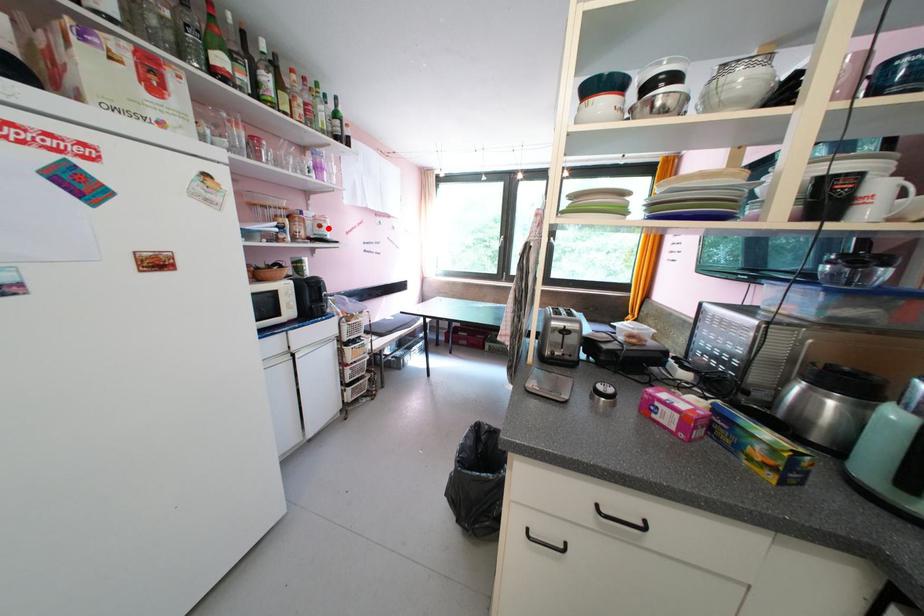
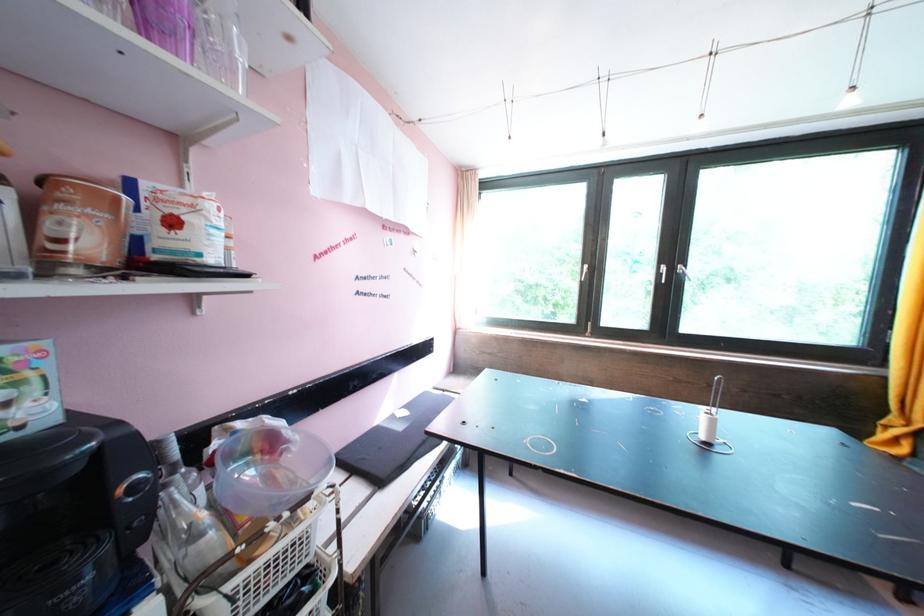
Find the pixel in the second image that matches the highlighted location in the first image.

(181, 225)